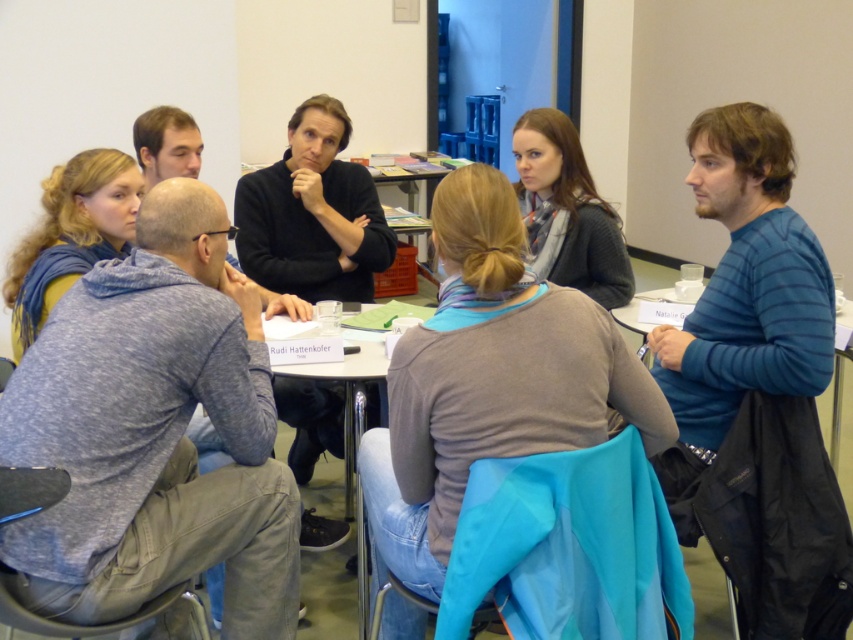
Question: Estimate the real-world distances between objects in this image. Which object is farther from the blue scarf at upper left?

Choices:
 (A) metallic silver table at center
 (B) gray sweater at center

Answer: (B)

Question: Can you confirm if knitted gray sweater at center is positioned to the left of blue scarf at upper left?

Choices:
 (A) yes
 (B) no

Answer: (B)

Question: Estimate the real-world distances between objects in this image. Which object is closer to the knitted gray sweater at center?

Choices:
 (A) blue scarf at upper left
 (B) metallic silver table at center

Answer: (B)

Question: Which object is farther from the camera taking this photo?

Choices:
 (A) metallic silver table at center
 (B) knitted gray sweater at center

Answer: (B)

Question: In this image, where is knitted gray sweater at center located relative to metallic silver table at center?

Choices:
 (A) right
 (B) left

Answer: (A)

Question: Is blue scarf at upper left to the right of metallic silver table at center from the viewer's perspective?

Choices:
 (A) yes
 (B) no

Answer: (B)